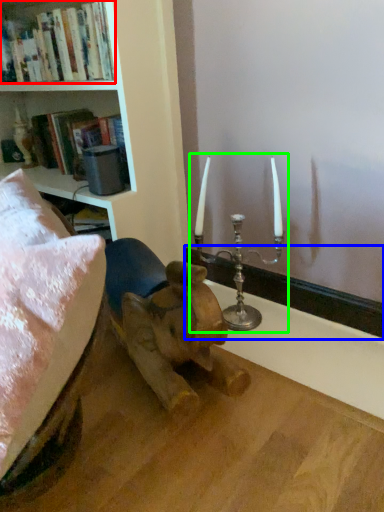
Question: Based on their relative distances, which object is nearer to book (highlighted by a red box)? Choose from window sill (highlighted by a blue box) and candle holder (highlighted by a green box).

Choices:
 (A) window sill
 (B) candle holder

Answer: (B)